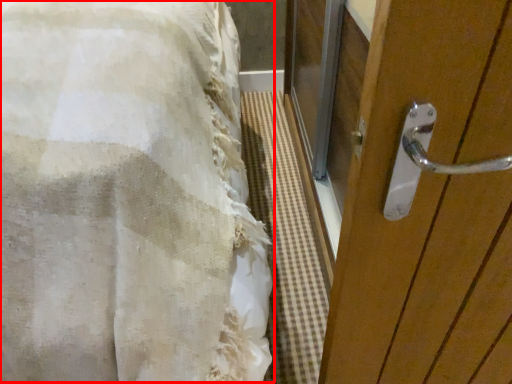
Question: From the image's perspective, what is the correct spatial relationship of bed (annotated by the red box) in relation to door?

Choices:
 (A) above
 (B) below

Answer: (B)